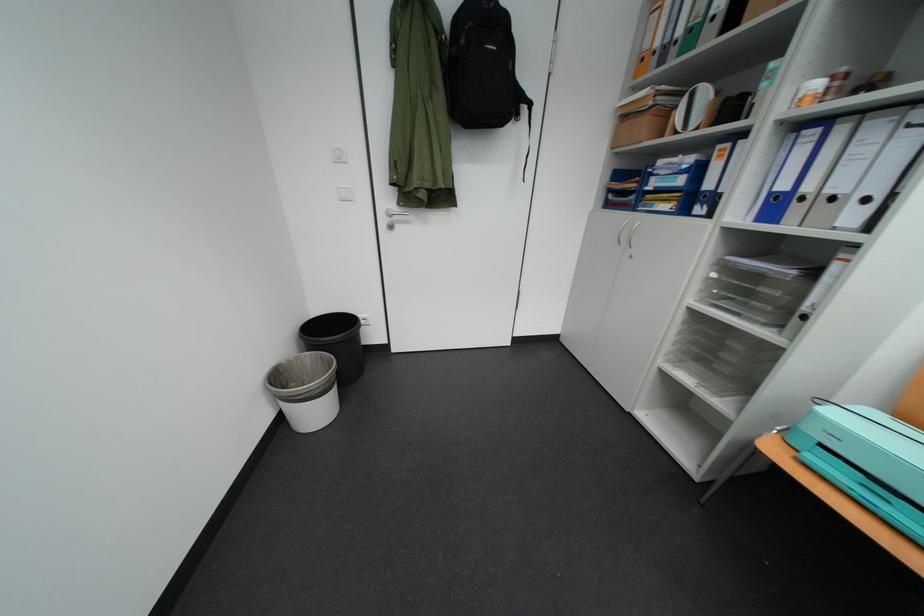
The image size is (924, 616). I want to click on chair sitting surface, so click(842, 503).